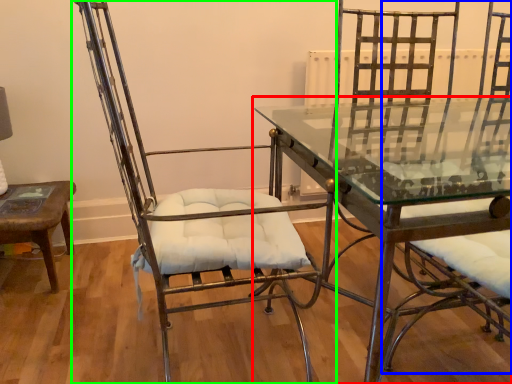
Question: Considering the real-world distances, which object is closest to table (highlighted by a red box)? swivel chair (highlighted by a blue box) or chair (highlighted by a green box).

Choices:
 (A) swivel chair
 (B) chair

Answer: (B)